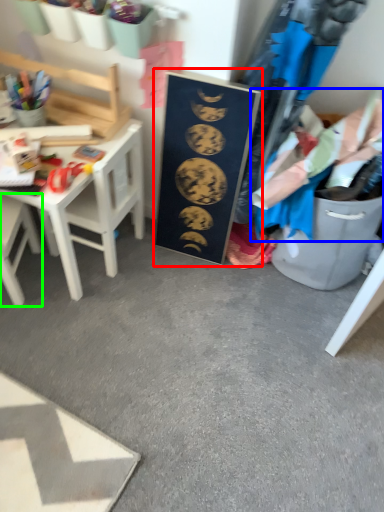
Question: Estimate the real-world distances between objects in this image. Which object is closer to bulletin board (highlighted by a red box), clothing (highlighted by a blue box) or chair (highlighted by a green box)?

Choices:
 (A) clothing
 (B) chair

Answer: (A)